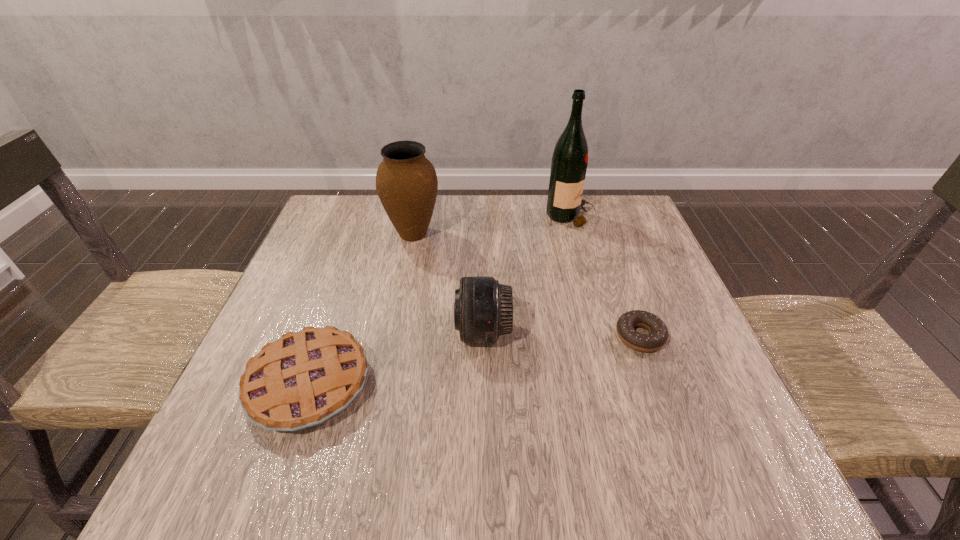
Identify the location of object present at the far right corner. tap(569, 163).

Find the location of a particular element. vacant space at the far edge of the desktop is located at coordinates (511, 202).

Locate an element on the screen. This screenshot has width=960, height=540. free space at the near edge of the desktop is located at coordinates (394, 492).

Find the location of a particular element. This screenshot has height=540, width=960. vacant space at the left edge is located at coordinates (362, 247).

Image resolution: width=960 pixels, height=540 pixels. I want to click on free space at the right edge of the desktop, so click(642, 354).

You are a GUI agent. You are given a task and a screenshot of the screen. Output one action in this format:
    pyautogui.click(x=<x>, y=<y>)
    Task: Click on the free location at the far left corner
    The width and height of the screenshot is (960, 540).
    Given the screenshot: What is the action you would take?
    pyautogui.click(x=326, y=207)

The image size is (960, 540). In the image, there is a desktop. In order to click on vacant space at the far right corner in this screenshot , I will do `click(599, 205)`.

The height and width of the screenshot is (540, 960). Identify the location of free space between the urn and the telephoto lens. (448, 283).

Locate an element on the screen. This screenshot has width=960, height=540. vacant space in between the doughnut and the third tallest object is located at coordinates (562, 334).

Locate an element on the screen. This screenshot has width=960, height=540. free space between the wine bottle and the pie is located at coordinates (440, 301).